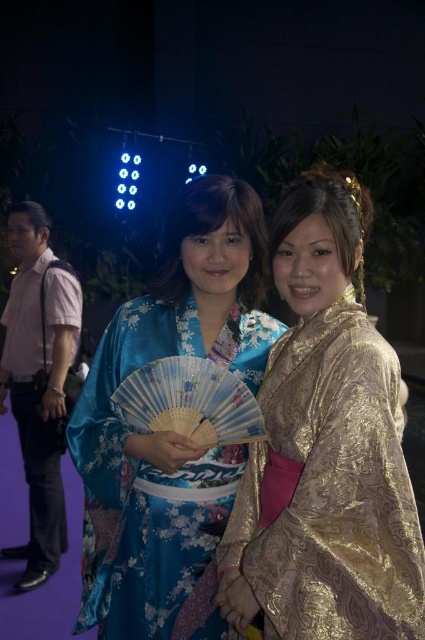
You are organizing a cultural event and need to arrange seating based on the width of attendees. If the gold shiny kimono at right and the pink shirt at left are the only two people present, which attendee requires a wider seat?

The pink shirt at left requires a wider seat because the gold shiny kimono at right is thinner than the pink shirt at left.